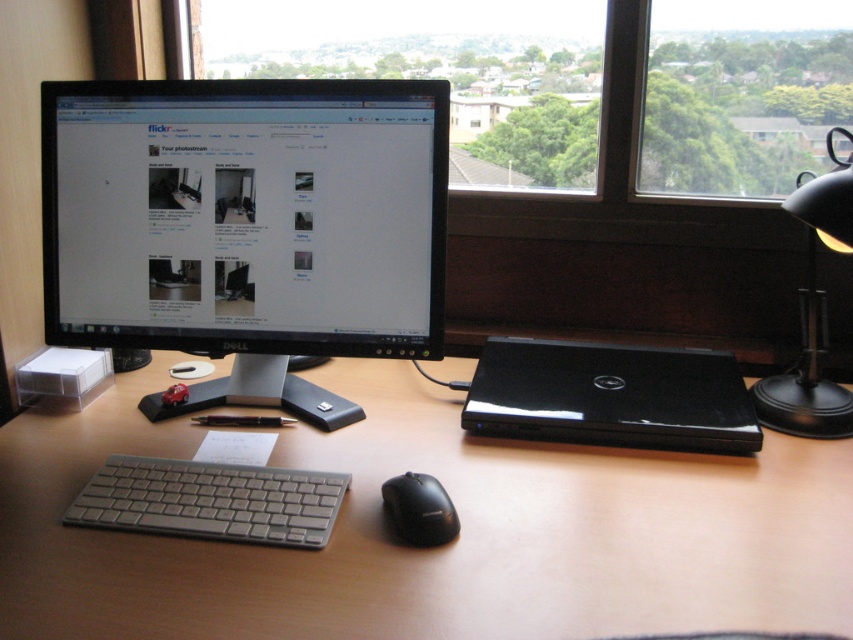
You are sitting at the desk and want to reach both the silver plastic keyboard at lower left and the transparent glass window at center. Which object is easier to reach without moving your chair?

The silver plastic keyboard at lower left is closer to the viewer, so it is easier to reach without moving your chair.

You are organizing your desk and need to place a new item between the wooden at center and the black matte mouse at center. Considering their heights, which object should the new item be placed closer to?

The wooden at center is much taller than the black matte mouse at center, so the new item should be placed closer to the black matte mouse at center to maintain balance.